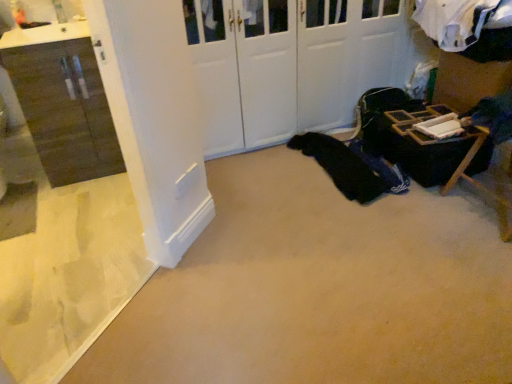
At what (x,y) coordinates should I click in order to perform the action: click on vacant space in front of wooden folding table at lower right. Please return your answer as a coordinate pair (x, y). This screenshot has width=512, height=384. Looking at the image, I should click on (418, 218).